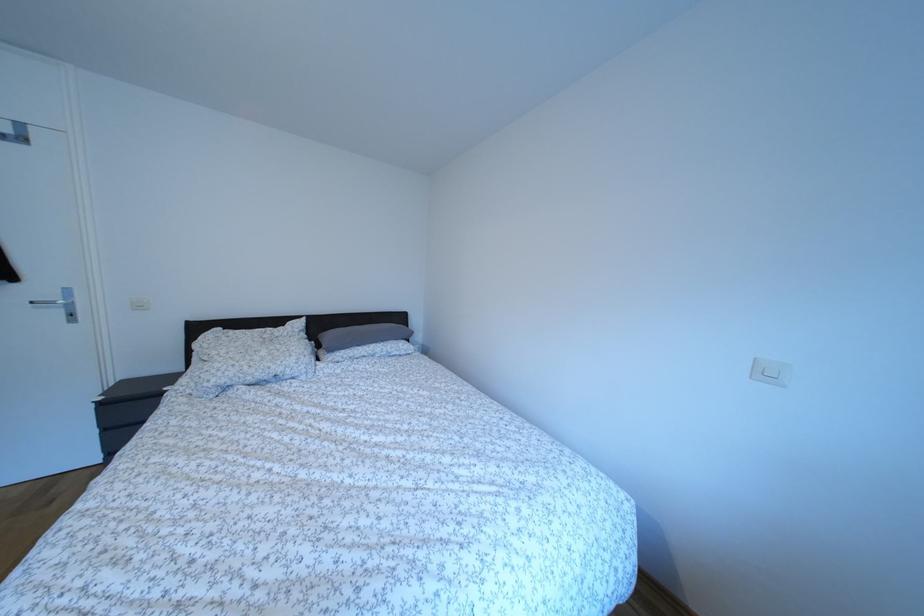
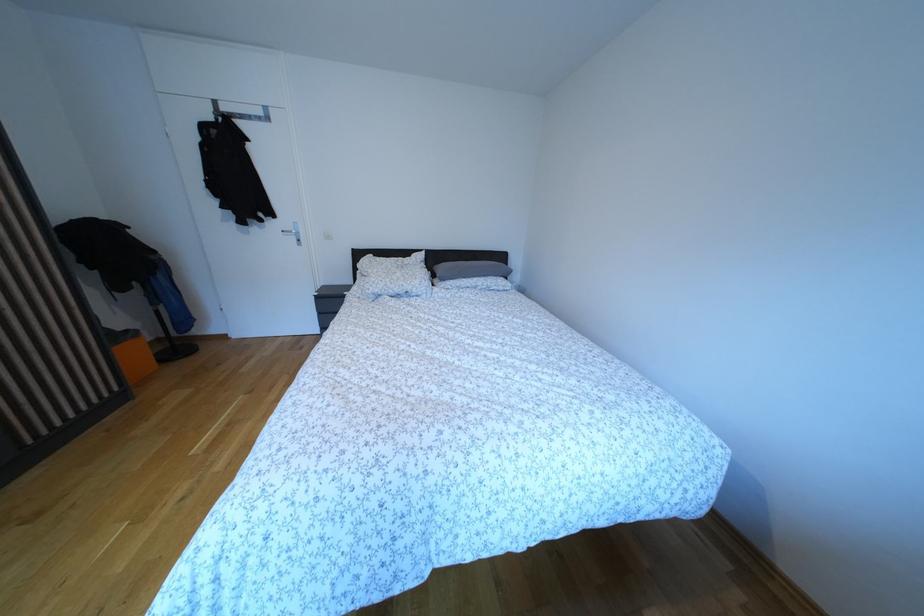
Question: What movement of the cameraman would produce the second image?

Choices:
 (A) Left
 (B) Right
 (C) Forward
 (D) Backward

Answer: (D)